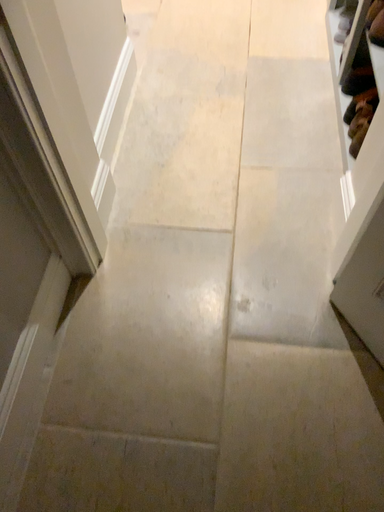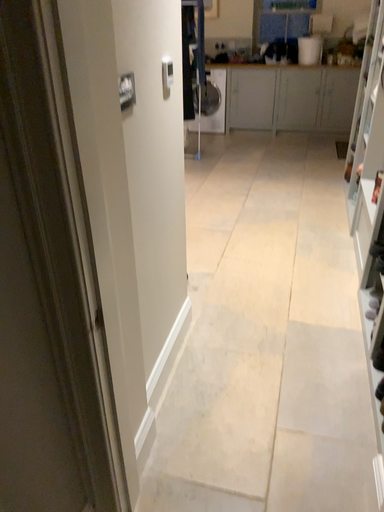
Question: How did the camera likely rotate when shooting the video?

Choices:
 (A) rotated downward
 (B) rotated upward

Answer: (B)